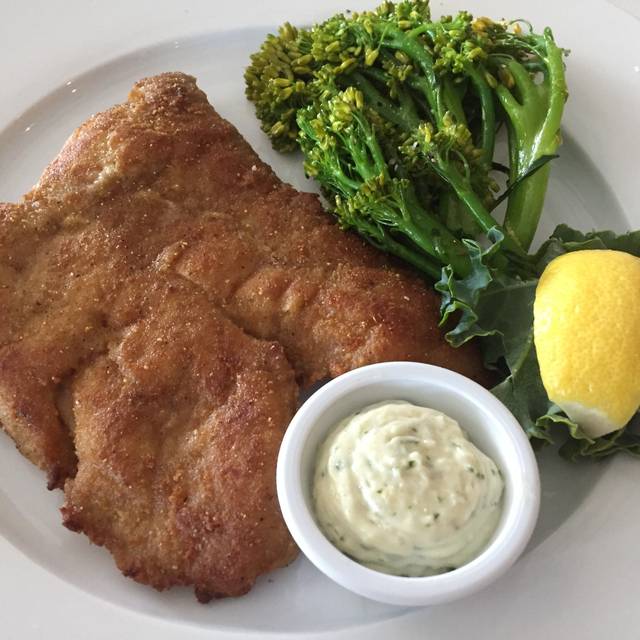
You are a GUI agent. You are given a task and a screenshot of the screen. Output one action in this format:
    pyautogui.click(x=<x>, y=<y>)
    Task: Click on the small white cup
    The image size is (640, 640).
    Given the screenshot: What is the action you would take?
    pyautogui.click(x=305, y=452)